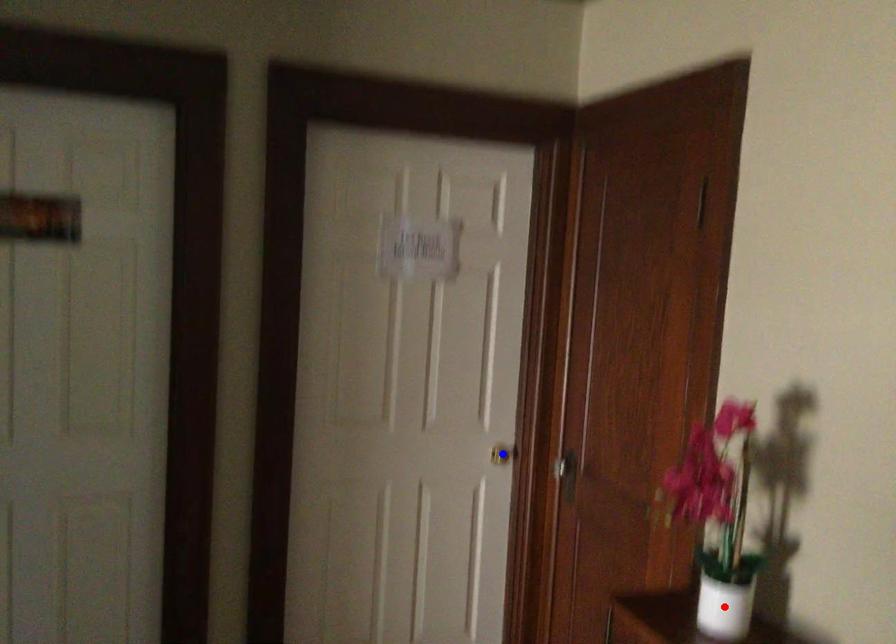
Question: Which of the two points in the image is closer to the camera?

Choices:
 (A) Blue point is closer.
 (B) Red point is closer.

Answer: (B)